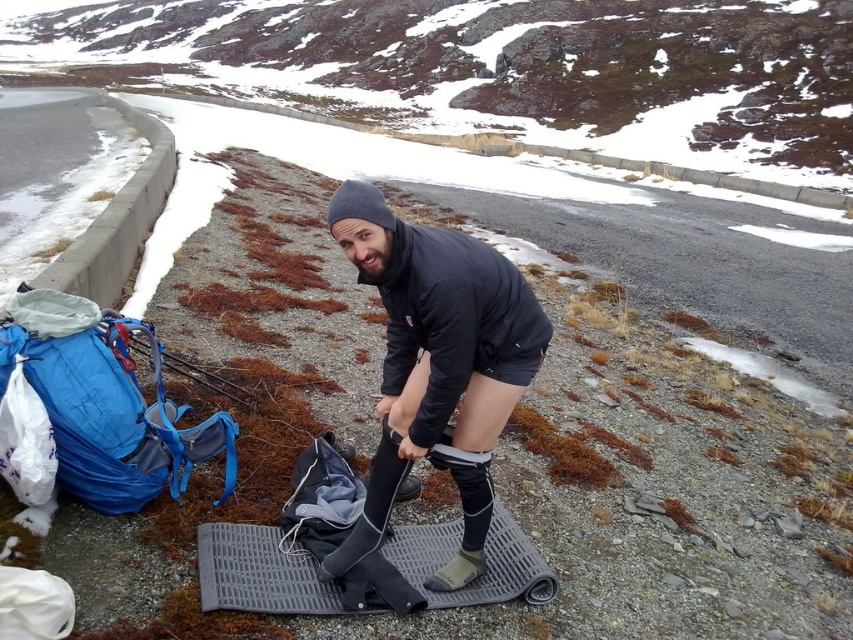
Can you confirm if black matte jacket at center is thinner than gray rubber mat at center?

Indeed, black matte jacket at center has a lesser width compared to gray rubber mat at center.

From the picture: Which of these two, black matte jacket at center or gray rubber mat at center, stands taller?

black matte jacket at center

Between point (448, 396) and point (274, 550), which one is positioned behind?

The point (274, 550) is more distant.

Where is `black matte jacket at center`? black matte jacket at center is located at coordinates (436, 365).